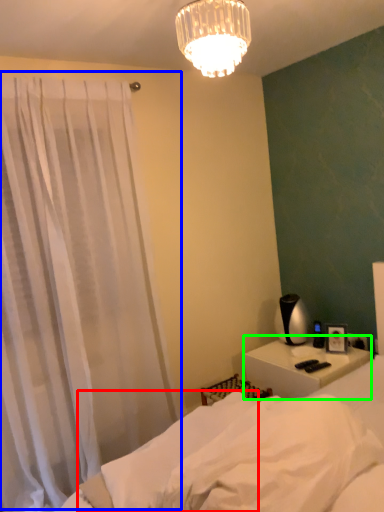
Question: Which object is the farthest from sheet (highlighted by a red box)? Choose among these: curtain (highlighted by a blue box) or nightstand (highlighted by a green box).

Choices:
 (A) curtain
 (B) nightstand

Answer: (B)